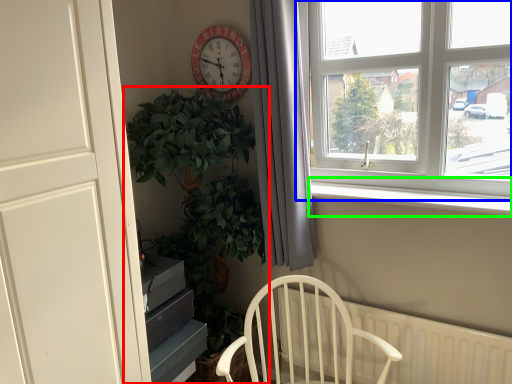
Question: Estimate the real-world distances between objects in this image. Which object is closer to houseplant (highlighted by a red box), window (highlighted by a blue box) or window sill (highlighted by a green box)?

Choices:
 (A) window
 (B) window sill

Answer: (B)